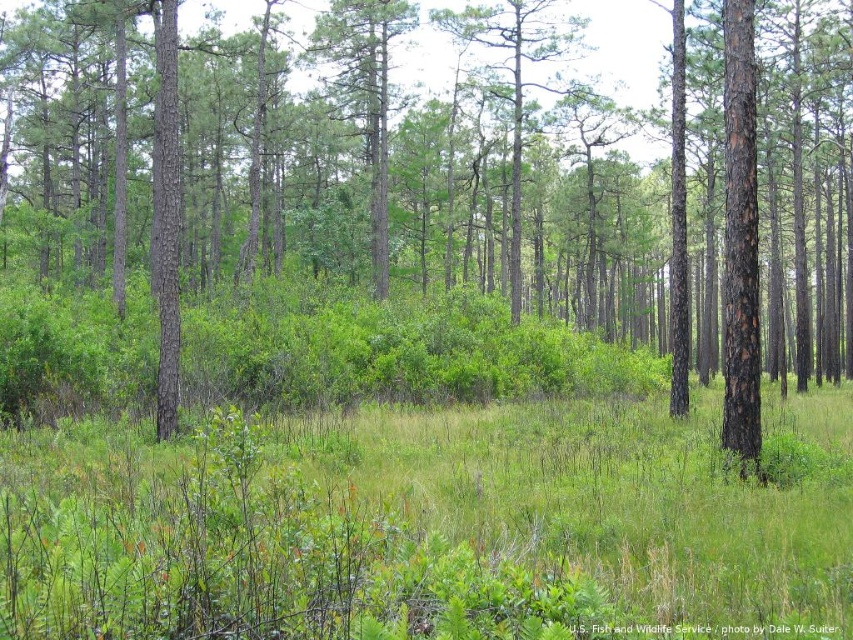
You are a hiker who wants to walk straight ahead in the forest scene. You see the brown rough tree at center and the green grassy at center. Which object will you encounter first as you walk forward?

The brown rough tree at center is to the left of green grassy at center, so you will encounter the green grassy at center first as you walk forward because it is positioned further ahead in your path compared to the brown rough tree at center.

You are a hiker trying to take a photo of the green grassy at center and the brown rough tree at center. Which object should you focus on first if you want both to be in sharp focus?

You should focus on the brown rough tree at center first because it is closer to you than the green grassy at center, which is behind it. By focusing on the closer object, you can ensure both are in focus using the depth of field.